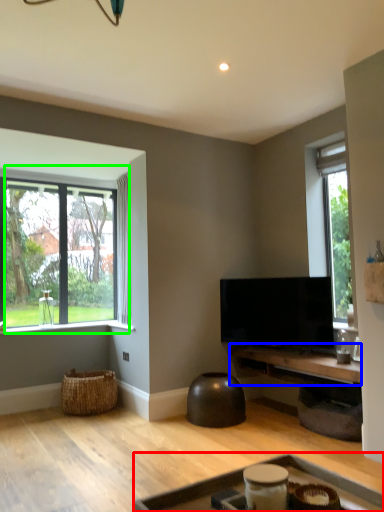
Question: Based on their relative distances, which object is nearer to table (highlighted by a red box)? Choose from table (highlighted by a blue box) and window (highlighted by a green box).

Choices:
 (A) table
 (B) window

Answer: (A)